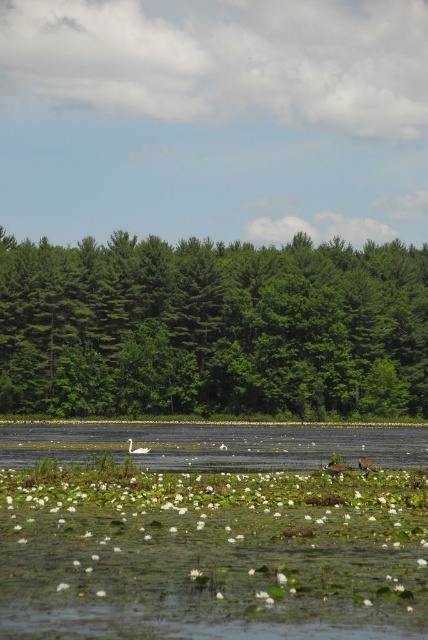
Between green leafy trees at center and white matte duck at center, which one is positioned lower?

white matte duck at center is below.

What do you see at coordinates (213, 328) in the screenshot? The width and height of the screenshot is (428, 640). I see `green leafy trees at center` at bounding box center [213, 328].

Does point (11, 369) lie in front of point (131, 452)?

That is False.

At what (x,y) coordinates should I click in order to perform the action: click on green leafy trees at center. Please return your answer as a coordinate pair (x, y). The image size is (428, 640). Looking at the image, I should click on (213, 328).

Which is more to the right, clear water at center or white matte duck at center?

From the viewer's perspective, clear water at center appears more on the right side.

Is clear water at center smaller than white matte duck at center?

No.

Measure the distance between clear water at center and camera.

clear water at center and camera are 120.99 feet apart from each other.

Identify the location of clear water at center. (216, 444).

Is green leafy trees at center bigger than clear water at center?

Indeed, green leafy trees at center has a larger size compared to clear water at center.

Does green leafy trees at center appear over clear water at center?

Indeed, green leafy trees at center is positioned over clear water at center.

You are a GUI agent. You are given a task and a screenshot of the screen. Output one action in this format:
    pyautogui.click(x=<x>, y=<y>)
    Task: Click on the green leafy trees at center
    
    Given the screenshot: What is the action you would take?
    pyautogui.click(x=213, y=328)